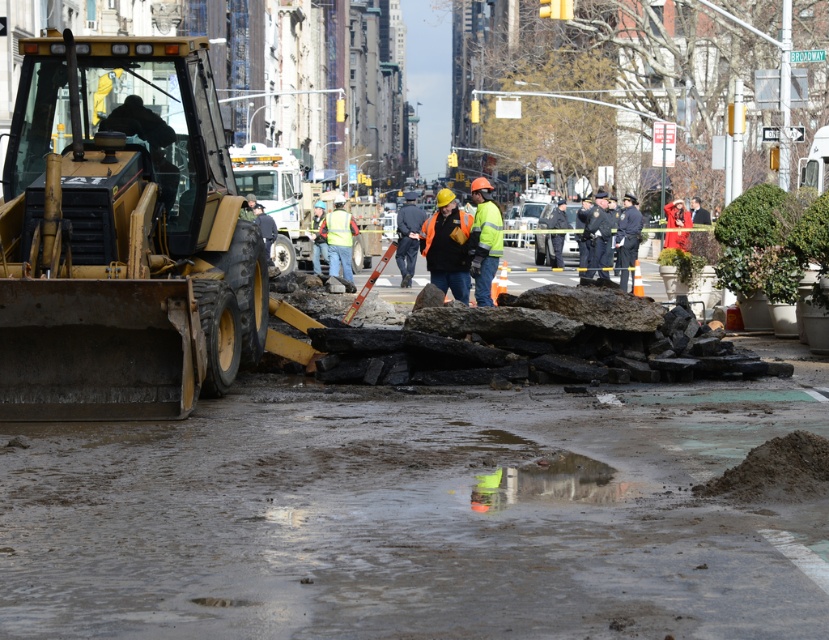
You are a pedestrian trying to cross the street and see the yellow metallic excavator at left and the orange reflective vest at center. Which object is closer to you?

The yellow metallic excavator at left is closer to you because it is in front of the orange reflective vest at center.